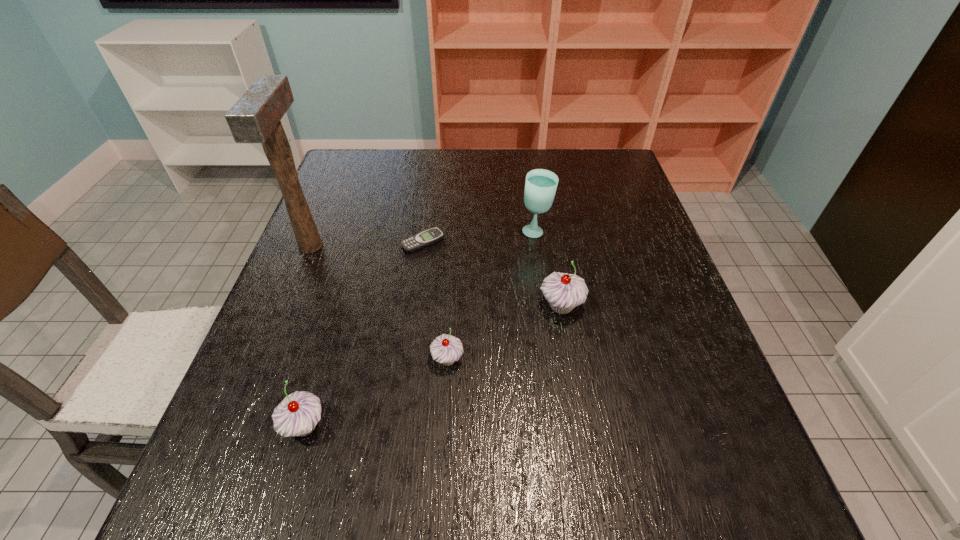
You are a GUI agent. You are given a task and a screenshot of the screen. Output one action in this format:
    pyautogui.click(x=<x>, y=<y>)
    Task: Click on the free spot at the far edge of the desktop
    
    Given the screenshot: What is the action you would take?
    pyautogui.click(x=513, y=163)

This screenshot has width=960, height=540. I want to click on vacant space at the left edge, so click(x=256, y=378).

Find the location of a particular element. vacant space at the right edge of the desktop is located at coordinates (637, 251).

Identify the location of vacant region at the near left corner of the desktop. The image size is (960, 540). point(305,444).

In the image, there is a desktop. At what (x,y) coordinates should I click in order to perform the action: click on blank space at the far right corner. Please return your answer as a coordinate pair (x, y). This screenshot has width=960, height=540. Looking at the image, I should click on (633, 190).

The height and width of the screenshot is (540, 960). What are the coordinates of `blank space at the near right corner` in the screenshot? It's located at (732, 426).

Find the location of `vacant point located between the glass and the second cupcake from right to left`. vacant point located between the glass and the second cupcake from right to left is located at coordinates (492, 296).

Image resolution: width=960 pixels, height=540 pixels. In order to click on free space between the second shortest cupcake and the glass in this screenshot , I will do `click(420, 329)`.

Identify the location of free space between the beeper and the farthest cupcake. (492, 274).

I want to click on free space between the shortest object and the fifth tallest object, so click(x=435, y=301).